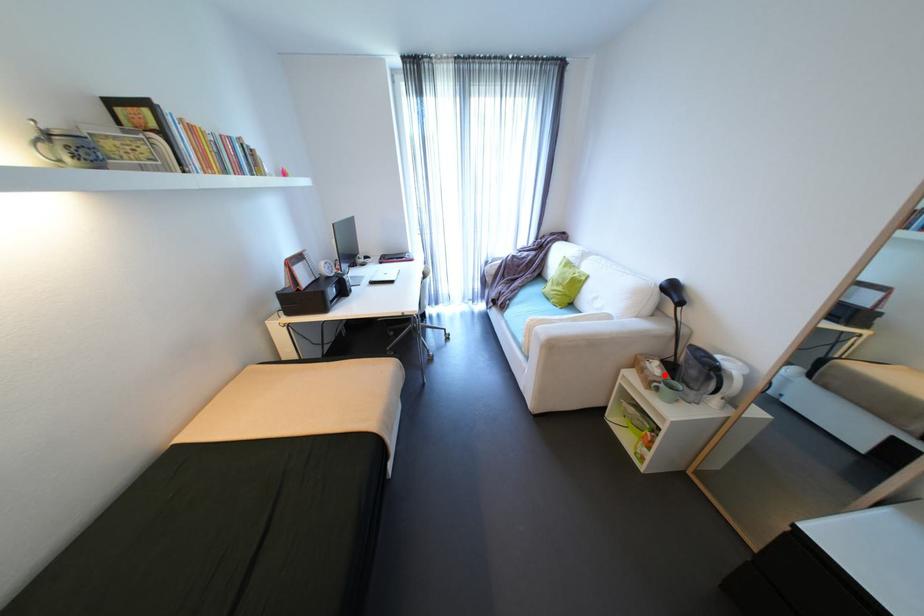
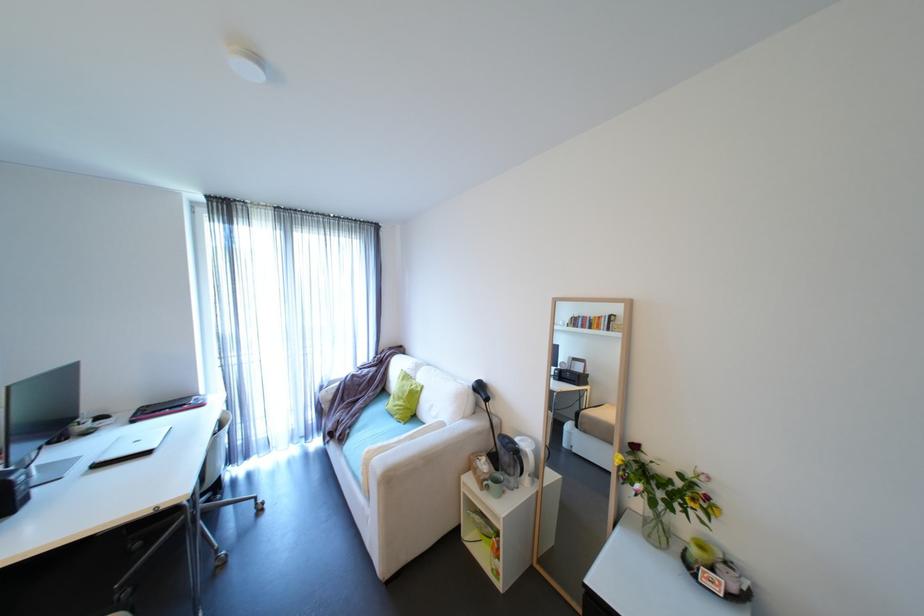
The point at the highlighted location is marked in the first image. Where is the corresponding point in the second image?

(492, 471)